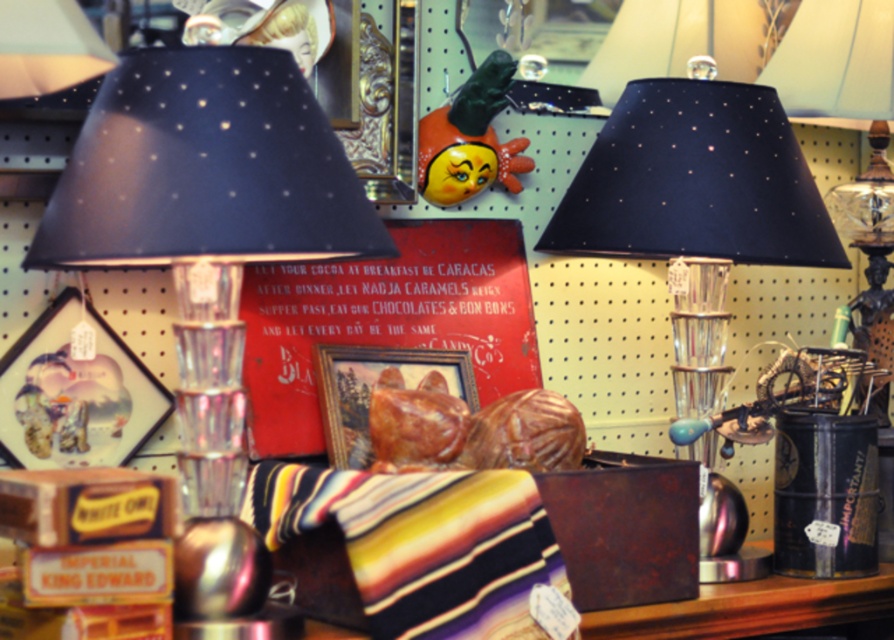
You are an interior designer planning to place a new decorative item between the matte glass lamp at left and the matte black lampshade at center. Considering their widths, which object should you position closer to the edge to ensure the new item fits comfortably?

The matte glass lamp at left has a smaller width than the matte black lampshade at center, so positioning the matte glass lamp at left closer to the edge would leave more space for the new item between them.